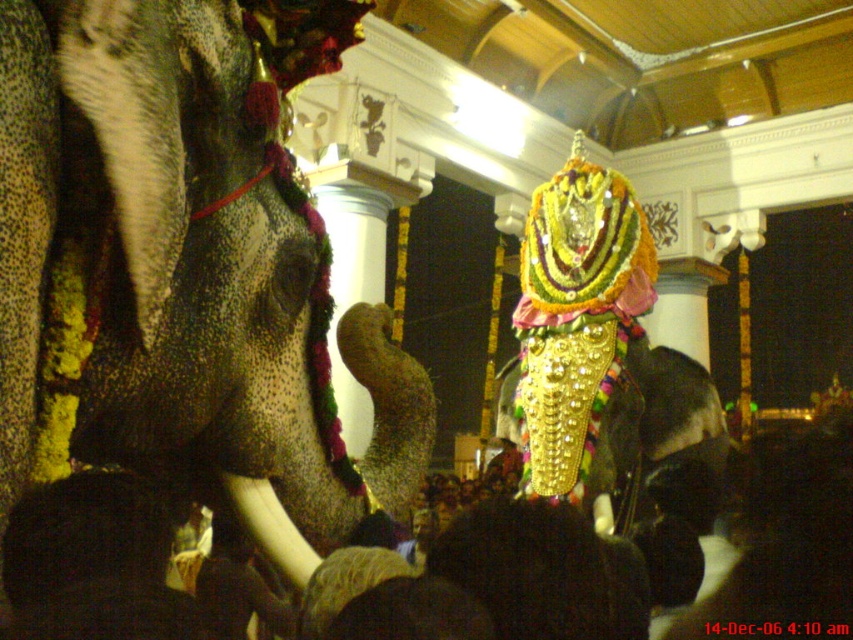
Question: Which point is closer to the camera?

Choices:
 (A) white ivory tusk at lower left
 (B) gold glittering mask at center
 (C) dark hair at center
 (D) polished gold statue at center

Answer: (A)

Question: Does dark hair at center appear over white ivory tusk at lower left?

Choices:
 (A) no
 (B) yes

Answer: (A)

Question: Which point is closer to the camera?

Choices:
 (A) (256, 500)
 (B) (608, 410)
 (C) (70, 252)
 (D) (769, 566)

Answer: (C)

Question: Can you confirm if gold glittering mask at center is positioned above white ivory tusk at lower left?

Choices:
 (A) yes
 (B) no

Answer: (B)

Question: Which object is positioned closest to the white ivory tusk at lower left?

Choices:
 (A) gold glittering mask at center
 (B) polished gold statue at center
 (C) dark hair at center

Answer: (B)

Question: From the image, what is the correct spatial relationship of polished gold statue at center in relation to gold glittering mask at center?

Choices:
 (A) below
 (B) above

Answer: (B)